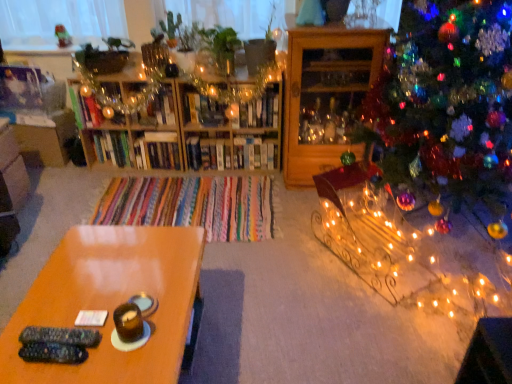
Question: Is white glossy bookshelf at center, acting as the 2th shelf starting from the left, bigger than iridescent glass ornaments at right?

Choices:
 (A) yes
 (B) no

Answer: (B)

Question: From a real-world perspective, is white glossy bookshelf at center, the second shelf when ordered from right to left, positioned over iridescent glass ornaments at right based on gravity?

Choices:
 (A) no
 (B) yes

Answer: (A)

Question: Would you say iridescent glass ornaments at right is part of white glossy bookshelf at center, the second shelf when ordered from right to left,'s contents?

Choices:
 (A) no
 (B) yes

Answer: (A)

Question: Considering the relative positions of white glossy bookshelf at center, the second shelf when ordered from right to left, and iridescent glass ornaments at right in the image provided, is white glossy bookshelf at center, the second shelf when ordered from right to left, in front of iridescent glass ornaments at right?

Choices:
 (A) no
 (B) yes

Answer: (A)

Question: Does white glossy bookshelf at center, acting as the 2th shelf starting from the left, have a greater width compared to iridescent glass ornaments at right?

Choices:
 (A) yes
 (B) no

Answer: (B)

Question: Is point (386, 162) positioned closer to the camera than point (51, 283)?

Choices:
 (A) farther
 (B) closer

Answer: (A)

Question: Looking at the image, does iridescent glass ornaments at right seem bigger or smaller compared to glossy wood table at lower left?

Choices:
 (A) big
 (B) small

Answer: (A)

Question: Choose the correct answer: Is iridescent glass ornaments at right inside glossy wood table at lower left or outside it?

Choices:
 (A) inside
 (B) outside

Answer: (B)

Question: From the image's perspective, is iridescent glass ornaments at right above or below glossy wood table at lower left?

Choices:
 (A) above
 (B) below

Answer: (A)

Question: From a real-world perspective, is white glossy bookshelf at center, the second shelf when ordered from right to left, positioned above or below wooden cabinet at right, arranged as the first shelf when viewed from the right?

Choices:
 (A) below
 (B) above

Answer: (A)

Question: In the image, is white glossy bookshelf at center, acting as the 2th shelf starting from the left, positioned in front of or behind wooden cabinet at right, the 3th shelf in the left-to-right sequence?

Choices:
 (A) behind
 (B) front

Answer: (A)

Question: From the image's perspective, is white glossy bookshelf at center, acting as the 2th shelf starting from the left, above or below wooden cabinet at right, the 3th shelf in the left-to-right sequence?

Choices:
 (A) below
 (B) above

Answer: (A)

Question: Based on their positions, is white glossy bookshelf at center, acting as the 2th shelf starting from the left, located to the left or right of wooden cabinet at right, arranged as the first shelf when viewed from the right?

Choices:
 (A) right
 (B) left

Answer: (B)

Question: Is glossy wood table at lower left inside the boundaries of wooden bookshelf at center, placed as the first shelf when sorted from left to right, or outside?

Choices:
 (A) inside
 (B) outside

Answer: (B)

Question: Looking at their shapes, would you say glossy wood table at lower left is wider or thinner than wooden bookshelf at center, placed as the first shelf when sorted from left to right?

Choices:
 (A) thin
 (B) wide

Answer: (B)